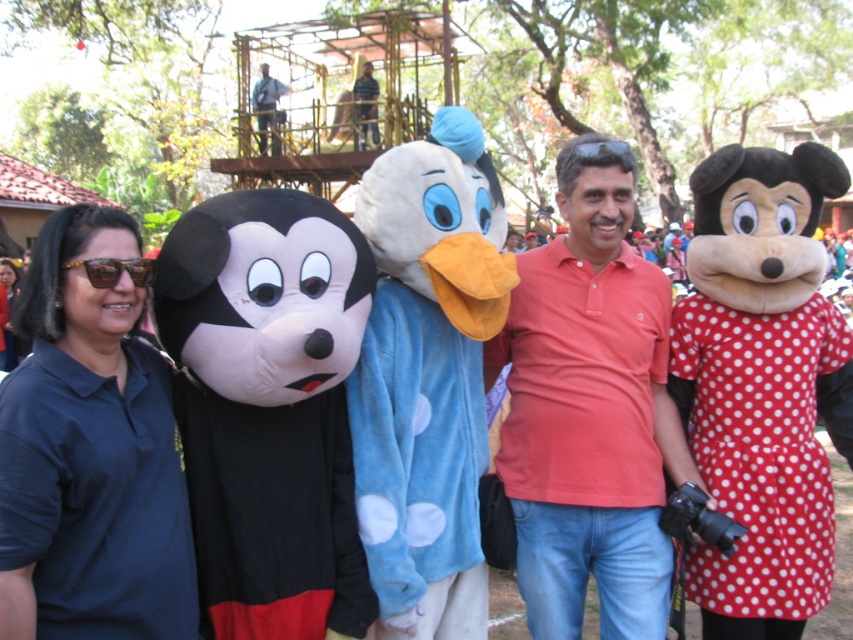
You are standing at the point marked by the coordinates (x=90, y=449) in the image. Looking around, you see the dark blue shirt at left. Which direction should you face to see the Donald Duck mascot in the center?

The dark blue shirt at left is located at point (x=90, y=449). Since Donald Duck is in the center, you should face towards the center of the image from the left position to see Donald Duck.

You are a photographer setting up for a group photo. You notice a dark blue shirt at left and a blue denim jeans at upper center in the scene. Which clothing item is more to the right?

The dark blue shirt at left is positioned on the right side of blue denim jeans at upper center, so the dark blue shirt at left is more to the right.

You are standing in the scene and want to take a photo of the dark blue shirt at left. Where should you position yourself to capture it in the frame?

To capture the dark blue shirt at left in the frame, position yourself facing the scene so that the dark blue shirt at left is visible at the coordinates point (90, 449).